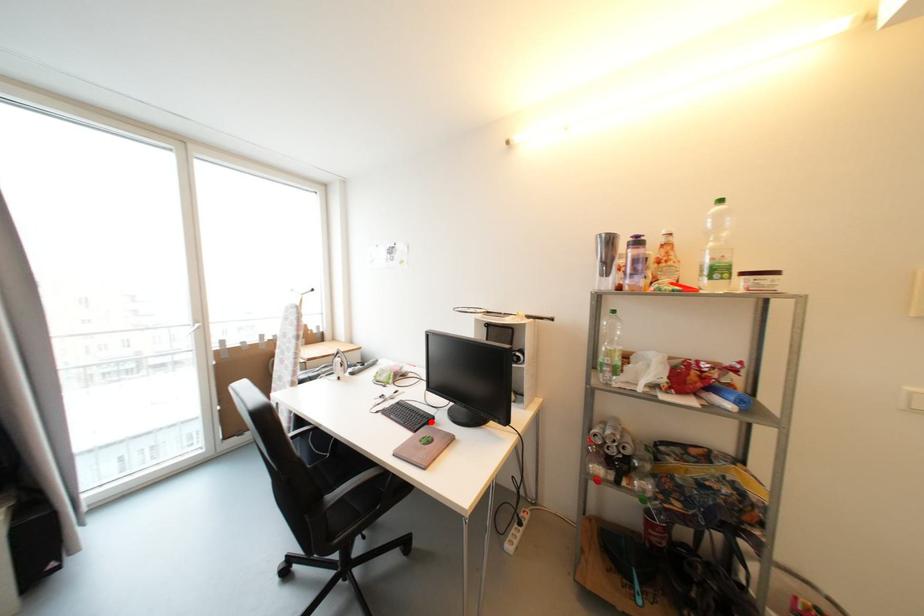
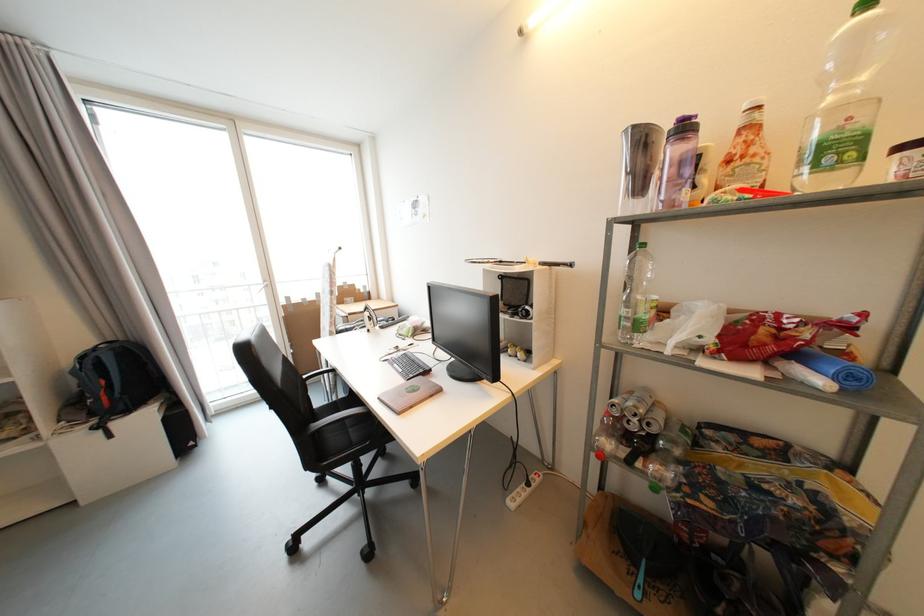
In the second image, find the point that corresponds to the highlighted location in the first image.

(427, 373)